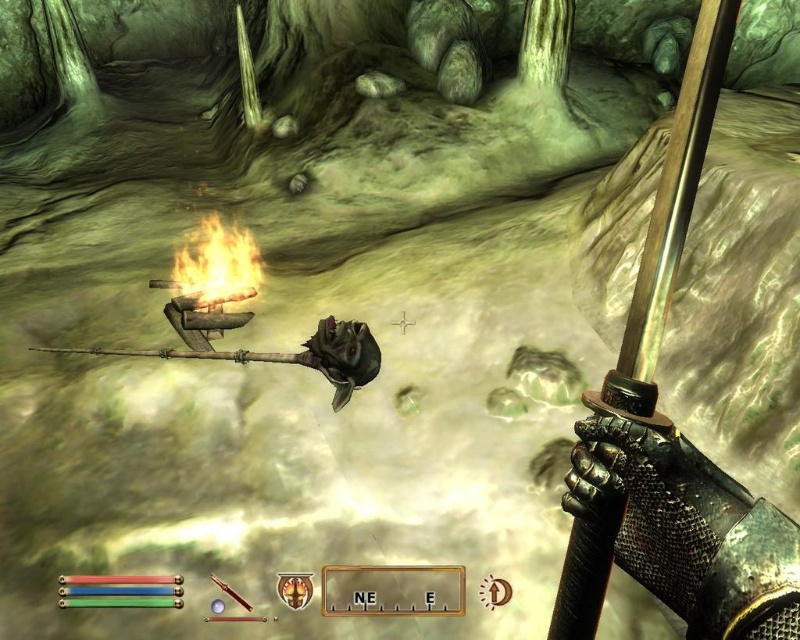
Is point (684, 83) less distant than point (254, 280)?

That is True.

In the scene shown: Measure the distance between point [656,346] and camera.

33.84 inches

The height and width of the screenshot is (640, 800). What do you see at coordinates (668, 224) in the screenshot? I see `polished steel sword at right` at bounding box center [668, 224].

Where is `polished steel sword at right`? The width and height of the screenshot is (800, 640). polished steel sword at right is located at coordinates (668, 224).